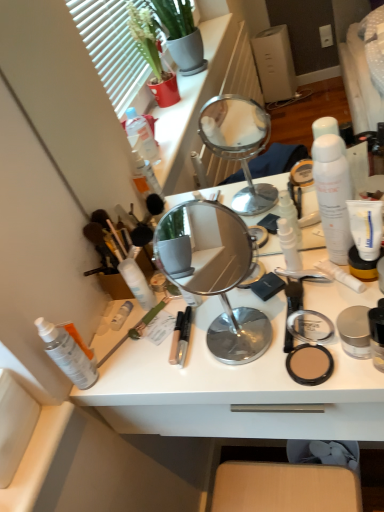
Where is `vacant area that lies between white matte lotion at center, which is counted as the 3th toiletry, starting from the left, and white matte tube at right, the second toothpaste viewed from the top`? The width and height of the screenshot is (384, 512). vacant area that lies between white matte lotion at center, which is counted as the 3th toiletry, starting from the left, and white matte tube at right, the second toothpaste viewed from the top is located at coordinates (233, 301).